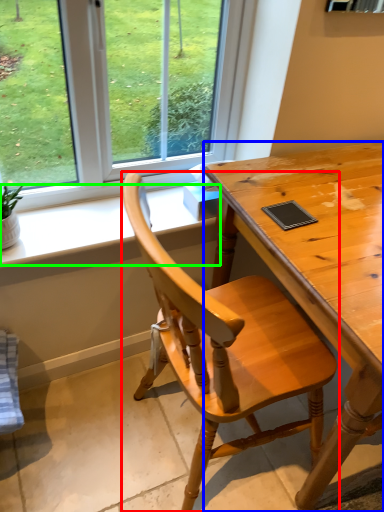
Question: Considering the real-world distances, which object is farthest from chair (highlighted by a red box)? desk (highlighted by a blue box) or window sill (highlighted by a green box)?

Choices:
 (A) desk
 (B) window sill

Answer: (B)